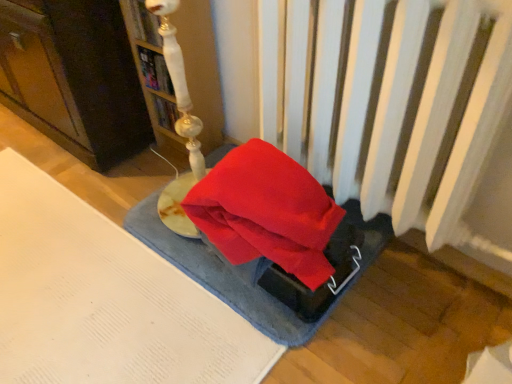
Question: Visually, is blue textured yoga mat at center positioned to the left or to the right of hardcover book at upper center, positioned as the 2th book in top-to-bottom order?

Choices:
 (A) right
 (B) left

Answer: (A)

Question: In terms of width, does blue textured yoga mat at center look wider or thinner when compared to hardcover book at upper center, the 1th book positioned from the bottom?

Choices:
 (A) thin
 (B) wide

Answer: (B)

Question: Which is farther from the matte white lamp at upper left?

Choices:
 (A) white glossy lamp at upper left, the 1th book when ordered from top to bottom
 (B) hardcover book at upper center, the 1th book positioned from the bottom
 (C) blue textured yoga mat at center

Answer: (C)

Question: Which object is positioned closest to the matte white lamp at upper left?

Choices:
 (A) white glossy lamp at upper left, the 1th book when ordered from top to bottom
 (B) blue textured yoga mat at center
 (C) hardcover book at upper center, positioned as the 2th book in top-to-bottom order

Answer: (C)